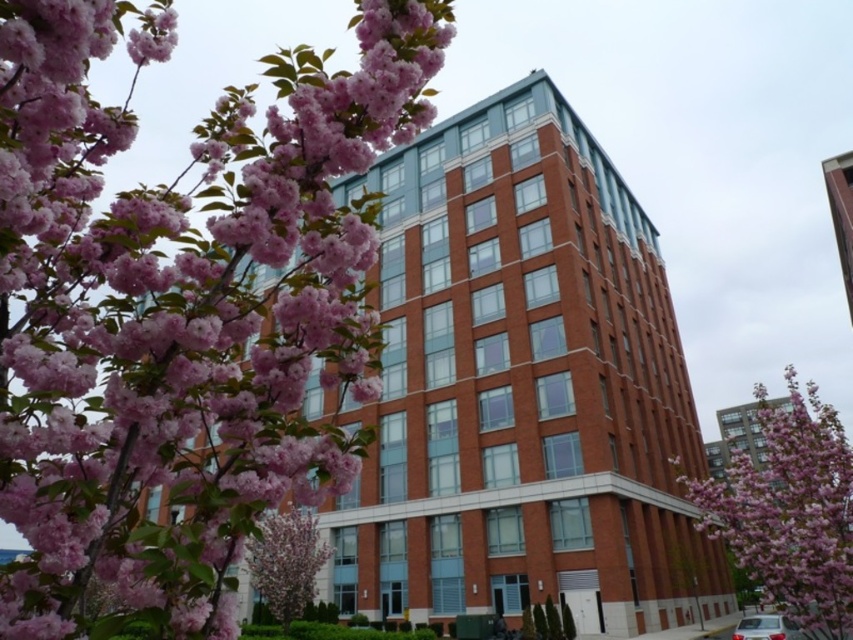
Based on the photo, you are an architect evaluating the building facade. You notice the pink matte blossoms at upper left and the pink bloom tree at lower left in the foreground. Which of these two objects appears closer to the building facade?

The pink bloom tree at lower left appears closer to the building facade because it is positioned lower and closer to the base of the structure compared to the pink matte blossoms at upper left, which are higher up and farther away.

You are a landscape architect designing a pathway that needs to pass between the pink matte blossoms at upper left and the pink bloom at center. The pathway must be at least 50 feet wide to accommodate large machinery. Based on the scene, will the existing space between these two features allow for this requirement?

The distance between the pink matte blossoms at upper left and the pink bloom at center is 49.75 feet, which is just under the required 50 feet. Therefore, the existing space is insufficient to accommodate the pathway width needed for large machinery.

You are a delivery person needing to park your 3.5 meters long metallic silver car at lower right near the pink bloom tree at lower left. Is there enough space between them to park the car without moving the tree?

The distance between the pink bloom tree at lower left and the metallic silver car at lower right is 12.57 meters. Since the car is only 3.5 meters long, there is sufficient space to park it without moving the tree.